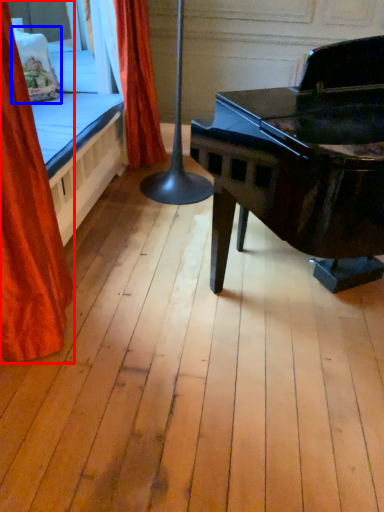
Question: Which object appears farthest to the camera in this image, curtain (highlighted by a red box) or pillow (highlighted by a blue box)?

Choices:
 (A) curtain
 (B) pillow

Answer: (B)